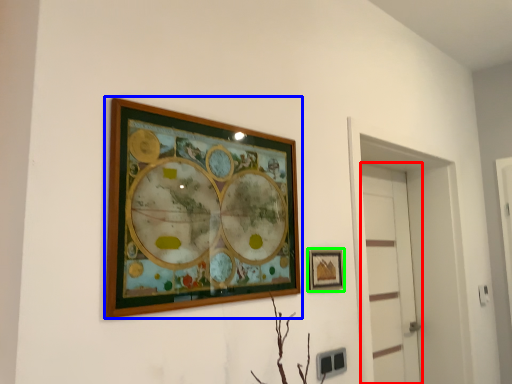
Question: Estimate the real-world distances between objects in this image. Which object is farther from door (highlighted by a red box), picture frame (highlighted by a blue box) or picture frame (highlighted by a green box)?

Choices:
 (A) picture frame
 (B) picture frame

Answer: (A)